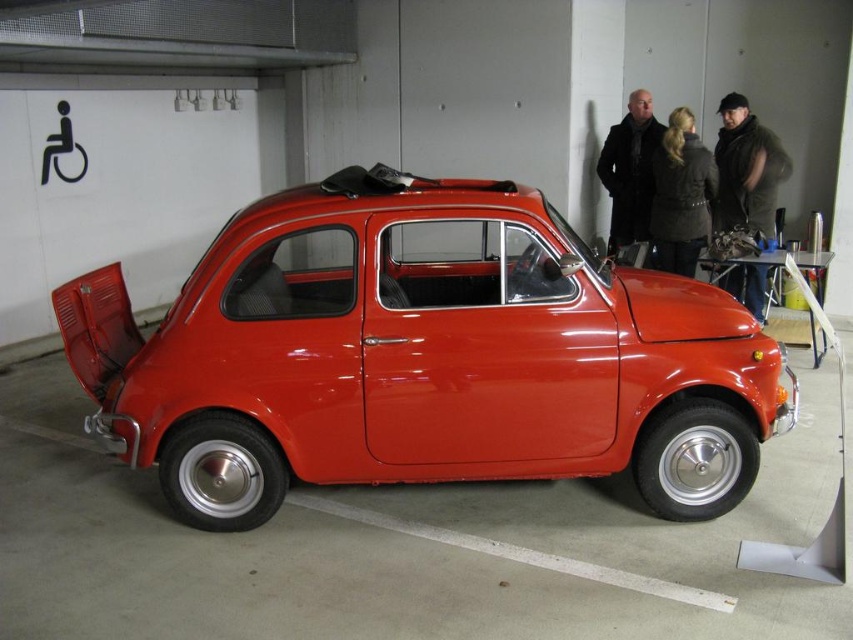
Is point (624, 298) positioned in front of point (602, 172)?

Yes, point (624, 298) is closer to viewer.

Locate an element on the screen. glossy red car at center is located at coordinates (422, 356).

Between dark brown leather jacket at center and black wool coat at upper right, which one is positioned lower?

dark brown leather jacket at center is below.

Between dark brown leather jacket at center and black wool coat at upper right, which one appears on the left side from the viewer's perspective?

Positioned to the left is black wool coat at upper right.

Locate an element on the screen. The width and height of the screenshot is (853, 640). dark brown leather jacket at center is located at coordinates (682, 195).

Does glossy red car at center have a smaller size compared to dark brown leather jacket at center?

No.

Is point (450, 340) farther from viewer compared to point (708, 186)?

That is False.

Where is `glossy red car at center`? This screenshot has height=640, width=853. glossy red car at center is located at coordinates [x=422, y=356].